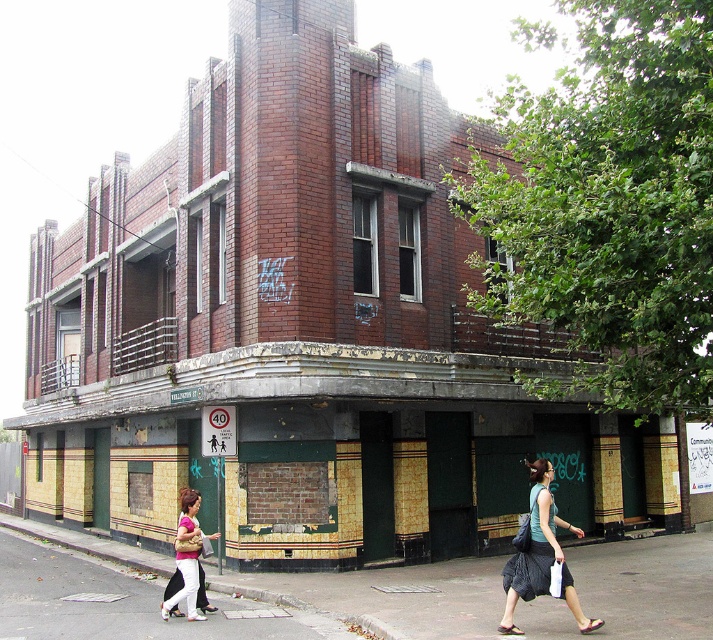
Question: Which point appears closest to the camera in this image?

Choices:
 (A) (538, 525)
 (B) (441, 440)
 (C) (51, 572)

Answer: (A)

Question: Does yellow tiled storefront at center come behind green fabric bag at lower right?

Choices:
 (A) yes
 (B) no

Answer: (A)

Question: Which is farther from the matte pink shirt at lower center?

Choices:
 (A) green fabric bag at lower right
 (B) yellow tiled storefront at center

Answer: (B)

Question: Which point is closer to the camera?

Choices:
 (A) yellow tiled storefront at center
 (B) matte pink shirt at lower center
 (C) green fabric bag at lower right

Answer: (C)

Question: Does smooth concrete sidewalk at lower center appear on the left side of matte pink shirt at lower center?

Choices:
 (A) no
 (B) yes

Answer: (B)

Question: Can you confirm if smooth concrete sidewalk at lower center is positioned above green fabric bag at lower right?

Choices:
 (A) yes
 (B) no

Answer: (B)